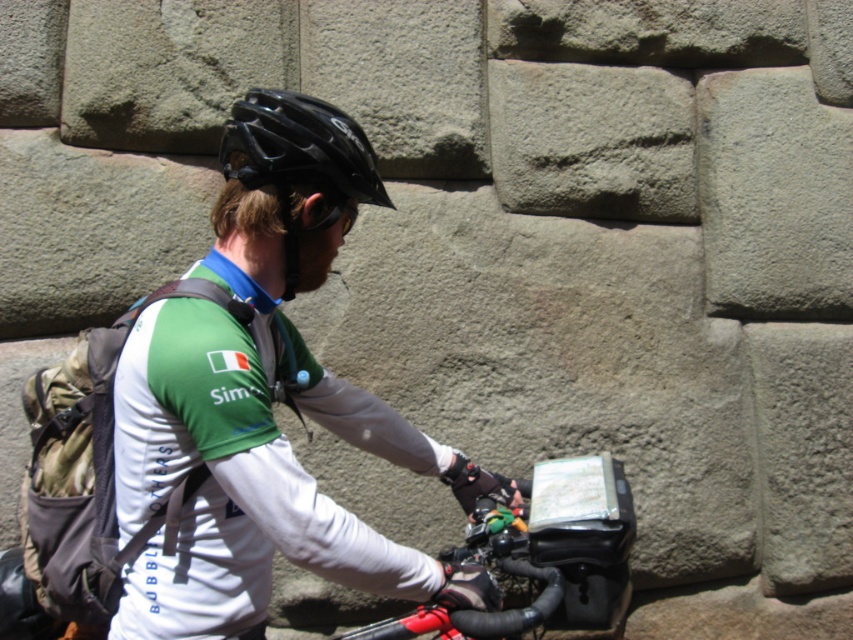
Who is lower down, matte black helmet at upper center or black matte helmet at upper center?

Positioned lower is matte black helmet at upper center.

The width and height of the screenshot is (853, 640). Describe the element at coordinates (265, 401) in the screenshot. I see `matte black helmet at upper center` at that location.

Locate an element on the screen. Image resolution: width=853 pixels, height=640 pixels. matte black helmet at upper center is located at coordinates (265, 401).

Can you confirm if gray rough stone at upper center is positioned below black matte helmet at upper center?

No.

Does gray rough stone at upper center appear on the right side of black matte helmet at upper center?

Correct, you'll find gray rough stone at upper center to the right of black matte helmet at upper center.

Does point (554, 84) come behind point (259, 176)?

Yes.

You are a GUI agent. You are given a task and a screenshot of the screen. Output one action in this format:
    pyautogui.click(x=<x>, y=<y>)
    Task: Click on the gray rough stone at upper center
    The height and width of the screenshot is (640, 853).
    Given the screenshot: What is the action you would take?
    pyautogui.click(x=592, y=140)

Which is more to the left, matte black helmet at upper center or gray rough stone at upper center?

matte black helmet at upper center

Who is positioned more to the right, matte black helmet at upper center or gray rough stone at upper center?

Positioned to the right is gray rough stone at upper center.

Where is `matte black helmet at upper center`? The image size is (853, 640). matte black helmet at upper center is located at coordinates (265, 401).